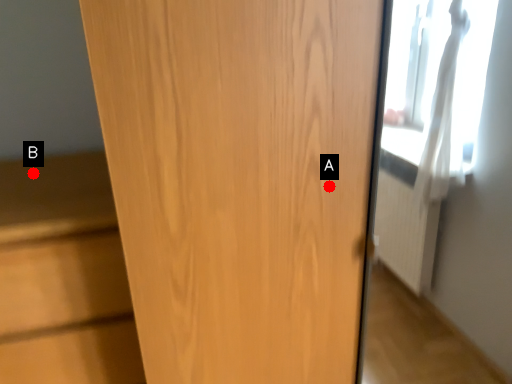
Question: Two points are circled on the image, labeled by A and B beside each circle. Which point is farther to the camera?

Choices:
 (A) A is further
 (B) B is further

Answer: (B)